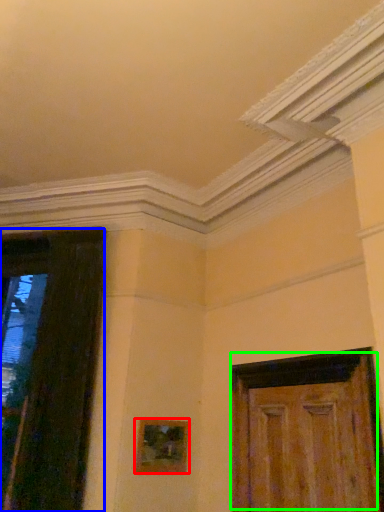
Question: Which object is positioned closest to picture frame (highlighted by a red box)? Select from door (highlighted by a blue box) and door (highlighted by a green box).

Choices:
 (A) door
 (B) door

Answer: (A)